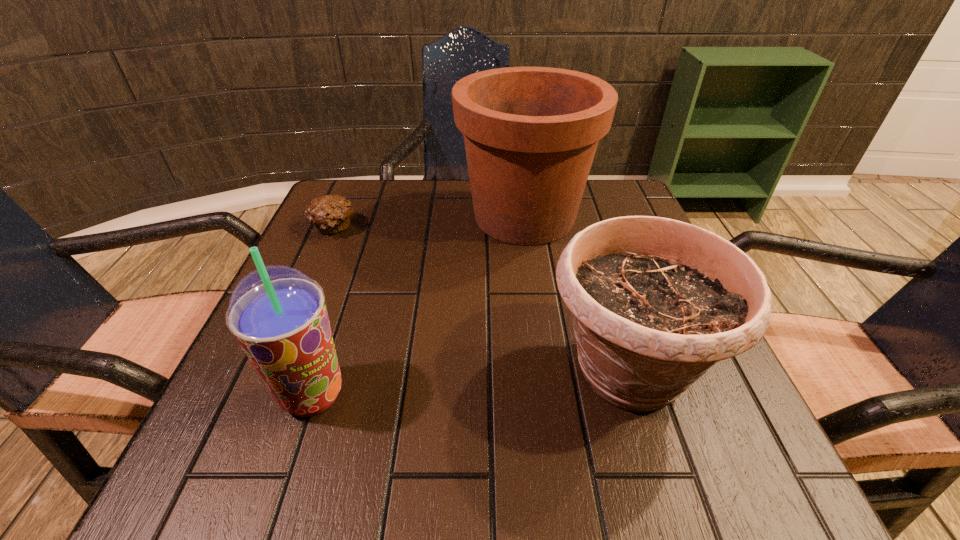
Locate an element on the screen. This screenshot has width=960, height=540. muffin positioned at the far edge is located at coordinates (330, 214).

This screenshot has height=540, width=960. Find the location of `object that is positioned at the near edge`. object that is positioned at the near edge is located at coordinates (655, 302).

I want to click on smoothie at the left edge, so click(x=278, y=314).

Locate an element on the screen. This screenshot has width=960, height=540. muffin that is positioned at the left edge is located at coordinates (330, 214).

This screenshot has height=540, width=960. What are the coordinates of `object situated at the far left corner` in the screenshot? It's located at (330, 214).

At what (x,y) coordinates should I click in order to perform the action: click on object at the far right corner. Please return your answer as a coordinate pair (x, y). This screenshot has height=540, width=960. Looking at the image, I should click on (531, 133).

Where is `object that is at the near right corner`? object that is at the near right corner is located at coordinates (655, 302).

In the image, there is a desktop. At what (x,y) coordinates should I click in order to perform the action: click on vacant space at the far edge. Please return your answer as a coordinate pair (x, y). Image resolution: width=960 pixels, height=540 pixels. Looking at the image, I should click on (407, 210).

Identify the location of vacant position at the near edge of the desktop. This screenshot has width=960, height=540. click(617, 482).

Identify the location of free spot at the left edge of the desktop. The height and width of the screenshot is (540, 960). (251, 402).